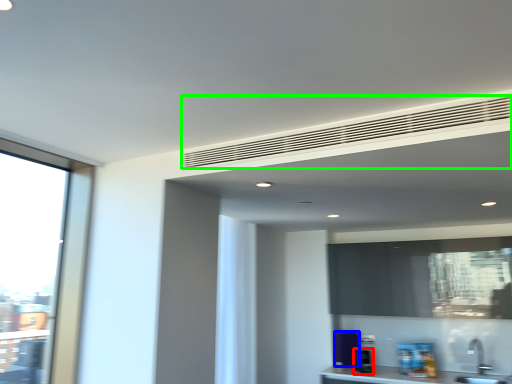
Question: Which object is positioned closest to appliance (highlighted by a red box)? Select from appliance (highlighted by a blue box) and blind (highlighted by a green box).

Choices:
 (A) appliance
 (B) blind

Answer: (A)